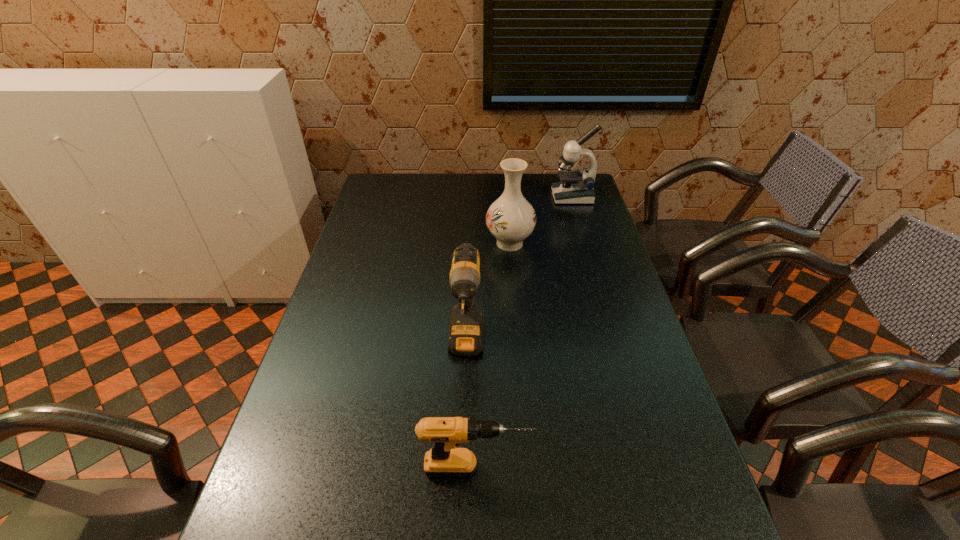
I want to click on free space located 0.210m on the front of the vase, so click(515, 302).

The height and width of the screenshot is (540, 960). Find the location of `free space located with the drill bit of the farther drill facing forward`. free space located with the drill bit of the farther drill facing forward is located at coordinates (464, 426).

Locate an element on the screen. The image size is (960, 540). free space located 0.300m at the tip of the shorter drill is located at coordinates click(x=671, y=468).

Where is `object that is at the far edge`? The width and height of the screenshot is (960, 540). object that is at the far edge is located at coordinates (577, 187).

At what (x,y) coordinates should I click in order to perform the action: click on object that is positioned at the right edge. Please return your answer as a coordinate pair (x, y). This screenshot has height=540, width=960. Looking at the image, I should click on (577, 187).

Where is `object that is at the far right corner`? The height and width of the screenshot is (540, 960). object that is at the far right corner is located at coordinates (577, 187).

What are the coordinates of `free space at the far edge of the desktop` in the screenshot? It's located at (434, 184).

Where is `vacant space at the left edge`? The image size is (960, 540). vacant space at the left edge is located at coordinates (308, 350).

This screenshot has height=540, width=960. What are the coordinates of `vacant space at the right edge of the desktop` in the screenshot? It's located at (649, 419).

The image size is (960, 540). Find the location of `vacant area at the far left corner of the desktop`. vacant area at the far left corner of the desktop is located at coordinates (389, 197).